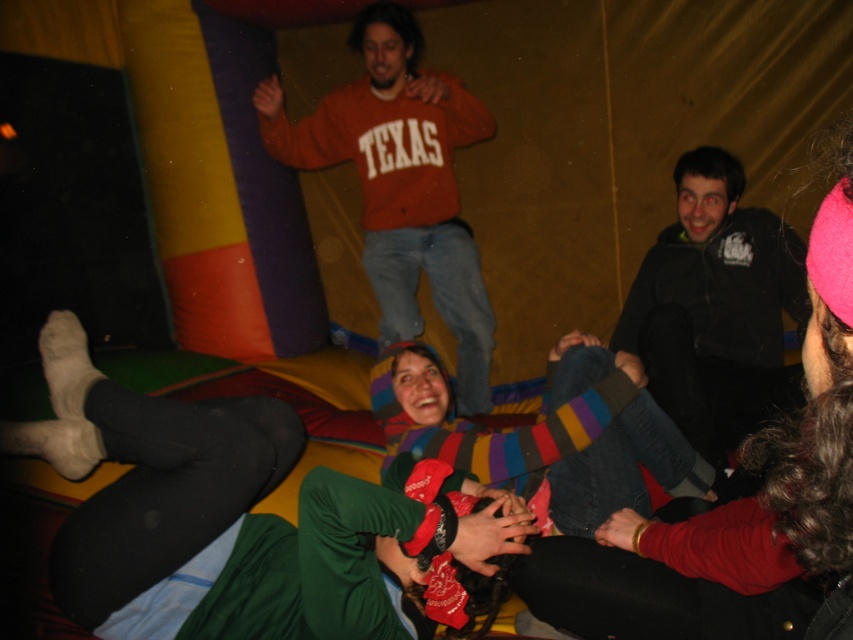
Between striped sweater at center and black soft jacket at upper right, which one appears on the left side from the viewer's perspective?

Positioned to the left is striped sweater at center.

Is striped sweater at center shorter than black soft jacket at upper right?

Yes, striped sweater at center is shorter than black soft jacket at upper right.

Is point (825, 301) less distant than point (665, 380)?

Yes, point (825, 301) is closer to viewer.

This screenshot has height=640, width=853. In order to click on striped sweater at center in this screenshot , I will do `click(738, 508)`.

Where is `striped sweater at center`? This screenshot has width=853, height=640. striped sweater at center is located at coordinates (738, 508).

Can you confirm if striped sweater at center is taller than matte red sweatshirt at center?

Incorrect, striped sweater at center's height is not larger of matte red sweatshirt at center's.

Between point (723, 545) and point (469, 268), which one is positioned in front?

Positioned in front is point (723, 545).

Locate an element on the screen. The image size is (853, 640). striped sweater at center is located at coordinates (738, 508).

Does matte red sweatshirt at center have a smaller size compared to black soft jacket at upper right?

Actually, matte red sweatshirt at center might be larger than black soft jacket at upper right.

In the scene shown: Who is higher up, matte red sweatshirt at center or black soft jacket at upper right?

Positioned higher is matte red sweatshirt at center.

Find the location of a particular element. The image size is (853, 640). matte red sweatshirt at center is located at coordinates (401, 182).